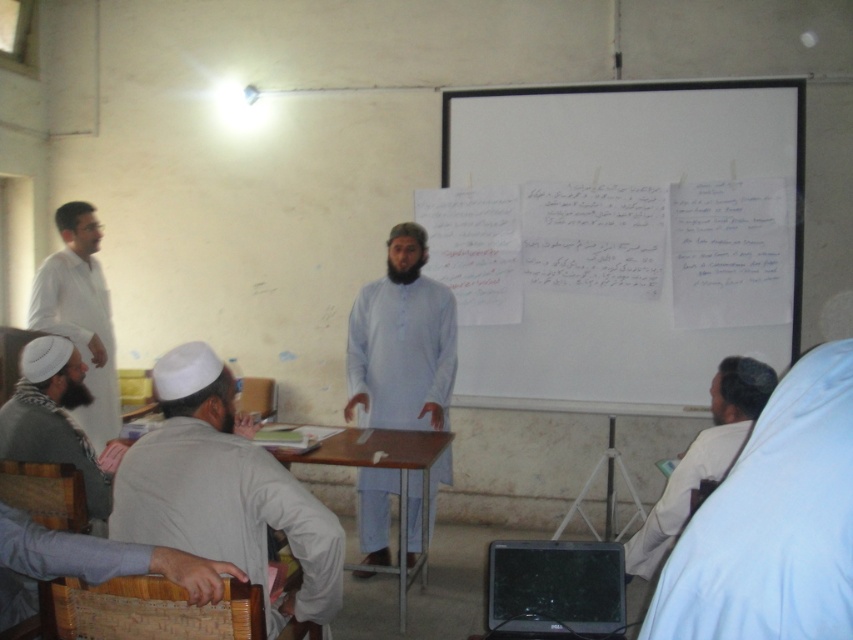
Question: Which object is closer to the camera taking this photo?

Choices:
 (A) bearded man in white robe at lower left
 (B) white cloth at lower right

Answer: (B)

Question: Based on their relative distances, which object is nearer to the light blue cotton shirt at center?

Choices:
 (A) light gray cotton shirt at lower left
 (B) white paper at upper center

Answer: (B)

Question: Does light gray cotton shirt at lower left appear under white matte shirt at left?

Choices:
 (A) no
 (B) yes

Answer: (B)

Question: Estimate the real-world distances between objects in this image. Which object is closer to the bearded man in white robe at lower left?

Choices:
 (A) wooden table at center
 (B) white cloth at lower right
 (C) light blue cotton shirt at center
 (D) white paper at upper center

Answer: (A)

Question: Is white matte shirt at left closer to the viewer compared to wooden table at center?

Choices:
 (A) no
 (B) yes

Answer: (A)

Question: Is light gray cotton shirt at lower left above wooden table at center?

Choices:
 (A) no
 (B) yes

Answer: (B)